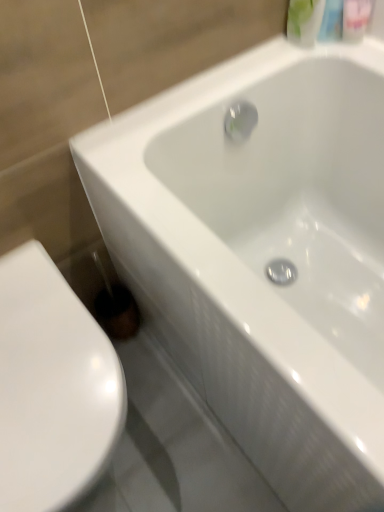
You are a GUI agent. You are given a task and a screenshot of the screen. Output one action in this format:
    pyautogui.click(x=<x>, y=<y>)
    Task: Click on the white glossy toilet at lower left
    The width and height of the screenshot is (384, 512).
    Given the screenshot: What is the action you would take?
    pyautogui.click(x=52, y=388)

Measure the distance between point (350,38) and camera.

Point (350,38) and camera are 38.23 inches apart from each other.

What is the approximate width of translucent plastic mouthwash at upper right, which is the first mouthwash from right to left?

2.46 inches.

Identify the location of white glossy toilet at lower left. This screenshot has height=512, width=384. (52, 388).

Can you tell me how much white glossy toilet at lower left and translucent plastic mouthwash at upper right, marked as the 2th mouthwash in a left-to-right arrangement, differ in facing direction?

They differ by 83.6 degrees in their facing directions.

Between white glossy toilet at lower left and translucent plastic mouthwash at upper right, marked as the 2th mouthwash in a left-to-right arrangement, which one has larger size?

white glossy toilet at lower left is bigger.

Considering the relative sizes of white glossy toilet at lower left and translucent plastic mouthwash at upper right, which is the first mouthwash from right to left, in the image provided, is white glossy toilet at lower left wider than translucent plastic mouthwash at upper right, which is the first mouthwash from right to left,?

Yes, white glossy toilet at lower left is wider than translucent plastic mouthwash at upper right, which is the first mouthwash from right to left.

From a real-world perspective, is green matte bottle at upper right, the first mouthwash when ordered from left to right, on translucent plastic mouthwash at upper right, which is the first mouthwash from right to left?

Correct, in the physical world, green matte bottle at upper right, the first mouthwash when ordered from left to right, is higher than translucent plastic mouthwash at upper right, which is the first mouthwash from right to left.

Which object is closer to the camera taking this photo, green matte bottle at upper right, the second mouthwash when ordered from right to left, or translucent plastic mouthwash at upper right, which is the first mouthwash from right to left?

green matte bottle at upper right, the second mouthwash when ordered from right to left.

Considering the points (295, 36) and (361, 14), which point is behind, point (295, 36) or point (361, 14)?

The point (295, 36) is farther.

Which is more to the right, green matte bottle at upper right, the second mouthwash when ordered from right to left, or translucent plastic mouthwash at upper right, which is the first mouthwash from right to left?

From the viewer's perspective, translucent plastic mouthwash at upper right, which is the first mouthwash from right to left, appears more on the right side.

Where is `toilet located on the left of green matte bottle at upper right, the second mouthwash when ordered from right to left`? Image resolution: width=384 pixels, height=512 pixels. toilet located on the left of green matte bottle at upper right, the second mouthwash when ordered from right to left is located at coordinates (52, 388).

Considering the sizes of objects green matte bottle at upper right, the second mouthwash when ordered from right to left, and white glossy toilet at lower left in the image provided, who is taller, green matte bottle at upper right, the second mouthwash when ordered from right to left, or white glossy toilet at lower left?

white glossy toilet at lower left is taller.

Would you say green matte bottle at upper right, the first mouthwash when ordered from left to right, is outside white glossy toilet at lower left?

Yes, green matte bottle at upper right, the first mouthwash when ordered from left to right, is located beyond the bounds of white glossy toilet at lower left.

Is green matte bottle at upper right, the second mouthwash when ordered from right to left, wider or thinner than white glossy toilet at lower left?

In the image, green matte bottle at upper right, the second mouthwash when ordered from right to left, appears to be more narrow than white glossy toilet at lower left.

Looking at this image, between white glossy toilet at lower left and green matte bottle at upper right, the first mouthwash when ordered from left to right, which one has less height?

green matte bottle at upper right, the first mouthwash when ordered from left to right, is shorter.

Considering the relative sizes of white glossy toilet at lower left and green matte bottle at upper right, the second mouthwash when ordered from right to left, in the image provided, is white glossy toilet at lower left smaller than green matte bottle at upper right, the second mouthwash when ordered from right to left,?

No.

Is white glossy toilet at lower left far from green matte bottle at upper right, the first mouthwash when ordered from left to right?

No.

Does point (61, 501) lie in front of point (297, 6)?

Yes, point (61, 501) is closer to viewer.

Would you say translucent plastic mouthwash at upper right, marked as the 2th mouthwash in a left-to-right arrangement, is outside white glossy toilet at lower left?

translucent plastic mouthwash at upper right, marked as the 2th mouthwash in a left-to-right arrangement, lies outside white glossy toilet at lower left's area.

From the image's perspective, which one is positioned higher, translucent plastic mouthwash at upper right, marked as the 2th mouthwash in a left-to-right arrangement, or white glossy toilet at lower left?

translucent plastic mouthwash at upper right, marked as the 2th mouthwash in a left-to-right arrangement, from the image's perspective.

Considering the relative sizes of translucent plastic mouthwash at upper right, which is the first mouthwash from right to left, and white glossy toilet at lower left in the image provided, is translucent plastic mouthwash at upper right, which is the first mouthwash from right to left, bigger than white glossy toilet at lower left?

No.

From a real-world perspective, is translucent plastic mouthwash at upper right, which is the first mouthwash from right to left, over white glossy toilet at lower left?

Yes, from a real-world perspective, translucent plastic mouthwash at upper right, which is the first mouthwash from right to left, is over white glossy toilet at lower left

Does translucent plastic mouthwash at upper right, which is the first mouthwash from right to left, lie in front of green matte bottle at upper right, the first mouthwash when ordered from left to right?

No, translucent plastic mouthwash at upper right, which is the first mouthwash from right to left, is behind green matte bottle at upper right, the first mouthwash when ordered from left to right.

Is translucent plastic mouthwash at upper right, marked as the 2th mouthwash in a left-to-right arrangement, far from green matte bottle at upper right, the second mouthwash when ordered from right to left?

Actually, translucent plastic mouthwash at upper right, marked as the 2th mouthwash in a left-to-right arrangement, and green matte bottle at upper right, the second mouthwash when ordered from right to left, are a little close together.

Visually, is translucent plastic mouthwash at upper right, marked as the 2th mouthwash in a left-to-right arrangement, positioned to the left or to the right of green matte bottle at upper right, the first mouthwash when ordered from left to right?

translucent plastic mouthwash at upper right, marked as the 2th mouthwash in a left-to-right arrangement, is positioned on green matte bottle at upper right, the first mouthwash when ordered from left to right,'s right side.

Between translucent plastic mouthwash at upper right, marked as the 2th mouthwash in a left-to-right arrangement, and green matte bottle at upper right, the first mouthwash when ordered from left to right, which one has more height?

green matte bottle at upper right, the first mouthwash when ordered from left to right.

The width and height of the screenshot is (384, 512). Identify the location of toilet that appears below the translucent plastic mouthwash at upper right, marked as the 2th mouthwash in a left-to-right arrangement (from a real-world perspective). (52, 388).

This screenshot has height=512, width=384. In order to click on mouthwash behind the green matte bottle at upper right, the second mouthwash when ordered from right to left in this screenshot , I will do `click(356, 18)`.

When comparing their distances from white glossy toilet at lower left, does green matte bottle at upper right, the first mouthwash when ordered from left to right, or translucent plastic mouthwash at upper right, which is the first mouthwash from right to left, seem closer?

Based on the image, green matte bottle at upper right, the first mouthwash when ordered from left to right, appears to be nearer to white glossy toilet at lower left.

Consider the image. Estimate the real-world distances between objects in this image. Which object is further from translucent plastic mouthwash at upper right, which is the first mouthwash from right to left, green matte bottle at upper right, the first mouthwash when ordered from left to right, or white glossy toilet at lower left?

Among the two, white glossy toilet at lower left is located further to translucent plastic mouthwash at upper right, which is the first mouthwash from right to left.

When comparing their distances from green matte bottle at upper right, the second mouthwash when ordered from right to left, does translucent plastic mouthwash at upper right, marked as the 2th mouthwash in a left-to-right arrangement, or white glossy toilet at lower left seem further?

Among the two, white glossy toilet at lower left is located further to green matte bottle at upper right, the second mouthwash when ordered from right to left.

Looking at the image, which one is located closer to translucent plastic mouthwash at upper right, marked as the 2th mouthwash in a left-to-right arrangement, white glossy toilet at lower left or green matte bottle at upper right, the first mouthwash when ordered from left to right?

The object closer to translucent plastic mouthwash at upper right, marked as the 2th mouthwash in a left-to-right arrangement, is green matte bottle at upper right, the first mouthwash when ordered from left to right.

In the scene shown: Which object lies nearer to the anchor point white glossy toilet at lower left, translucent plastic mouthwash at upper right, marked as the 2th mouthwash in a left-to-right arrangement, or green matte bottle at upper right, the second mouthwash when ordered from right to left?

green matte bottle at upper right, the second mouthwash when ordered from right to left, is positioned closer to the anchor white glossy toilet at lower left.

Which object lies further to the anchor point green matte bottle at upper right, the second mouthwash when ordered from right to left, white glossy toilet at lower left or translucent plastic mouthwash at upper right, marked as the 2th mouthwash in a left-to-right arrangement?

white glossy toilet at lower left.

Find the location of a particular element. mouthwash between green matte bottle at upper right, the first mouthwash when ordered from left to right, and white glossy toilet at lower left vertically is located at coordinates (356, 18).